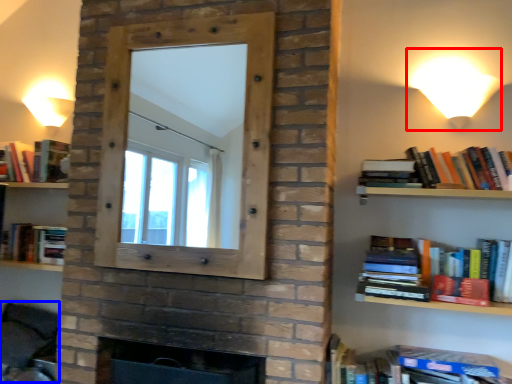
Question: Which object appears closest to the camera in this image, table lamp (highlighted by a red box) or swivel chair (highlighted by a blue box)?

Choices:
 (A) table lamp
 (B) swivel chair

Answer: (A)